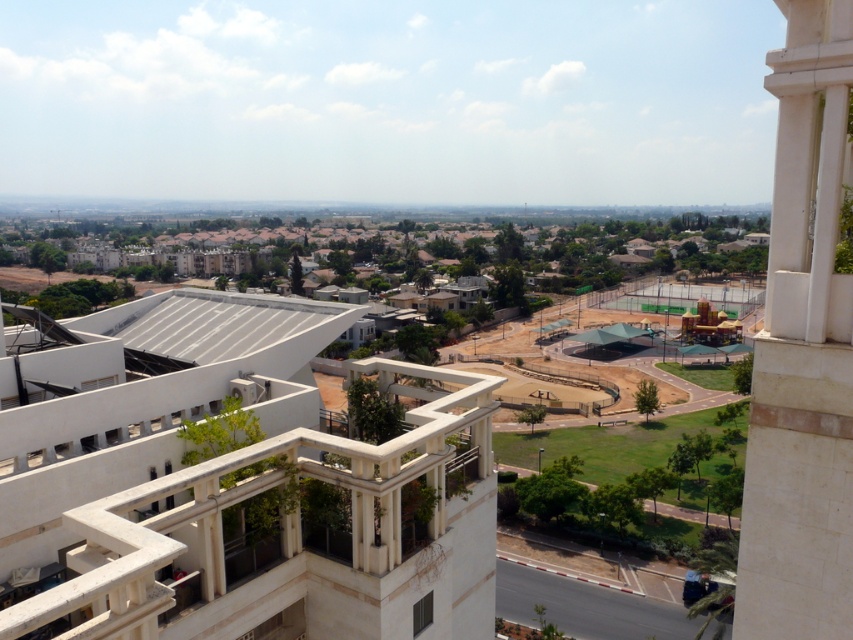
Can you confirm if white concrete balcony at center is thinner than white stone pillar at right?

In fact, white concrete balcony at center might be wider than white stone pillar at right.

Who is higher up, white concrete balcony at center or white stone pillar at right?

white stone pillar at right

Where is `white concrete balcony at center`? This screenshot has height=640, width=853. white concrete balcony at center is located at coordinates (x=297, y=532).